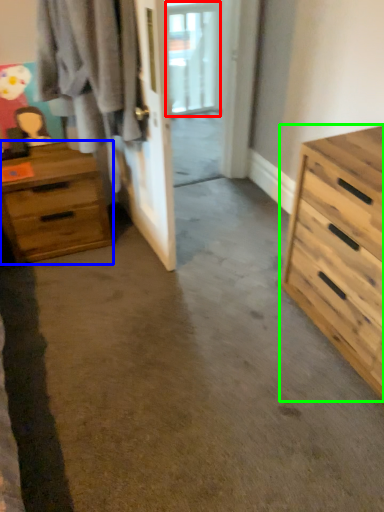
Question: Estimate the real-world distances between objects in this image. Which object is closer to window (highlighted by a red box), chest of drawers (highlighted by a blue box) or chest of drawers (highlighted by a green box)?

Choices:
 (A) chest of drawers
 (B) chest of drawers

Answer: (A)